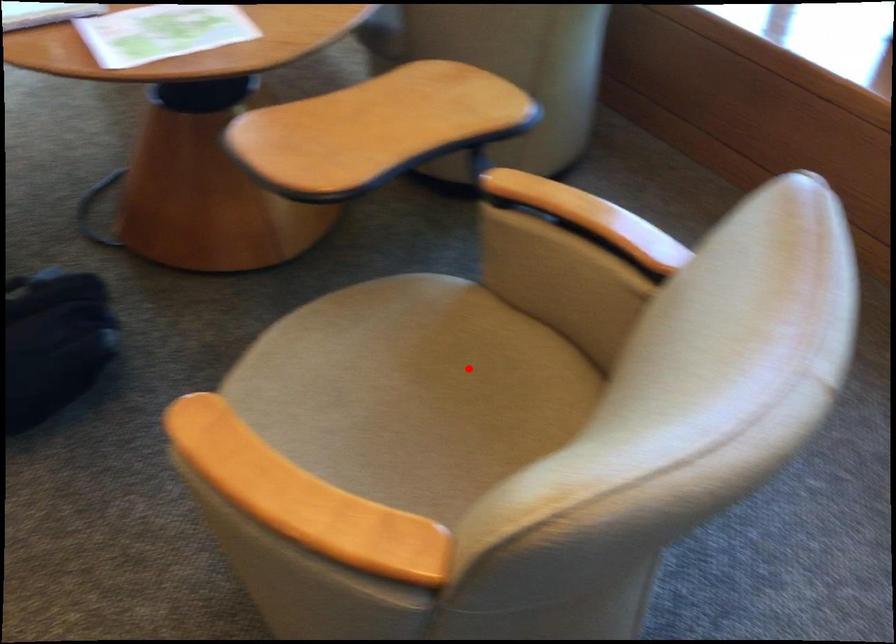
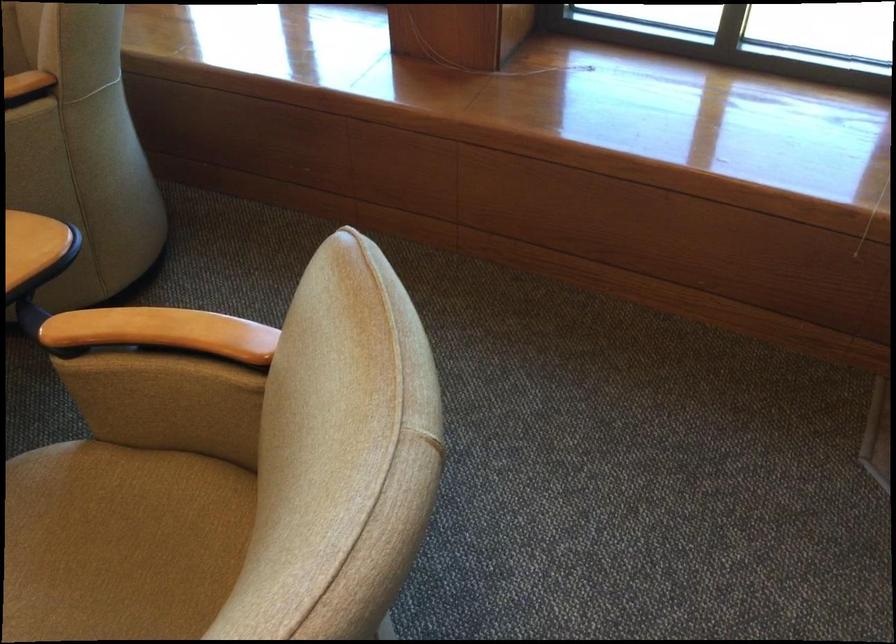
Where in the second image is the point corresponding to the highlighted location from the first image?

(121, 542)